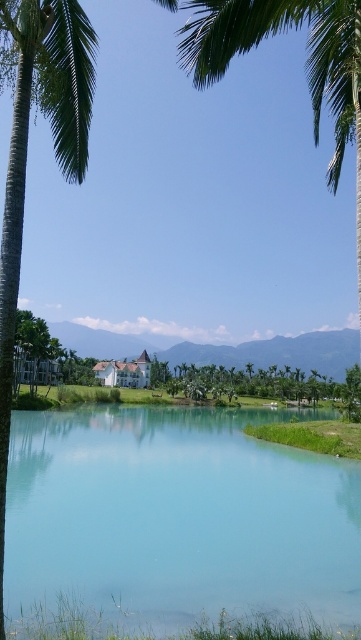
You are standing at the point marked as point (176, 516) in the tropical landscape. Looking around, you see clear blue water at center. Which direction would you face to look towards the clear blue water at center?

The clear blue water at center is located at point (176, 516), so you are already facing it. You don

You are planning to build a small boat dock in this tropical landscape. The dock needs to be placed where there is enough space for it. Based on the scene, which area should you choose between the clear blue water at center and the green leafy tree at center?

The green leafy tree at center occupies more space than the clear blue water at center, so you should choose the area near the green leafy tree at center for the dock since it has more space available.